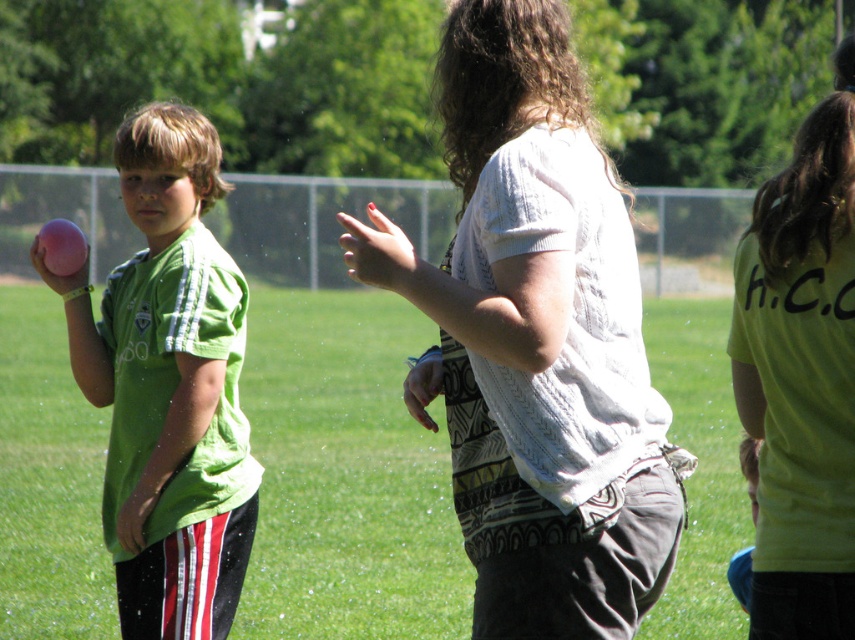
Question: Does white knitted sweater at center come in front of matte pink ball at left?

Choices:
 (A) yes
 (B) no

Answer: (A)

Question: Is white knitted sweater at center wider than matte pink ball at left?

Choices:
 (A) no
 (B) yes

Answer: (B)

Question: Among these points, which one is nearest to the camera?

Choices:
 (A) (457, 54)
 (B) (146, 465)

Answer: (A)

Question: Is white knitted sweater at center above matte pink ball at left?

Choices:
 (A) yes
 (B) no

Answer: (A)

Question: Among these objects, which one is farthest from the camera?

Choices:
 (A) white knitted sweater at center
 (B) matte pink ball at left

Answer: (B)